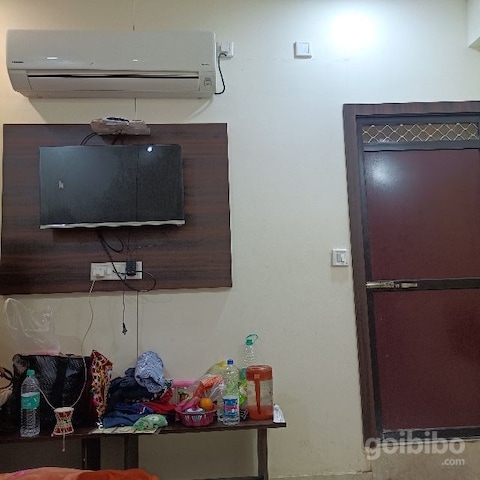
The height and width of the screenshot is (480, 480). Find the location of `space under aircon`. space under aircon is located at coordinates (121, 108).